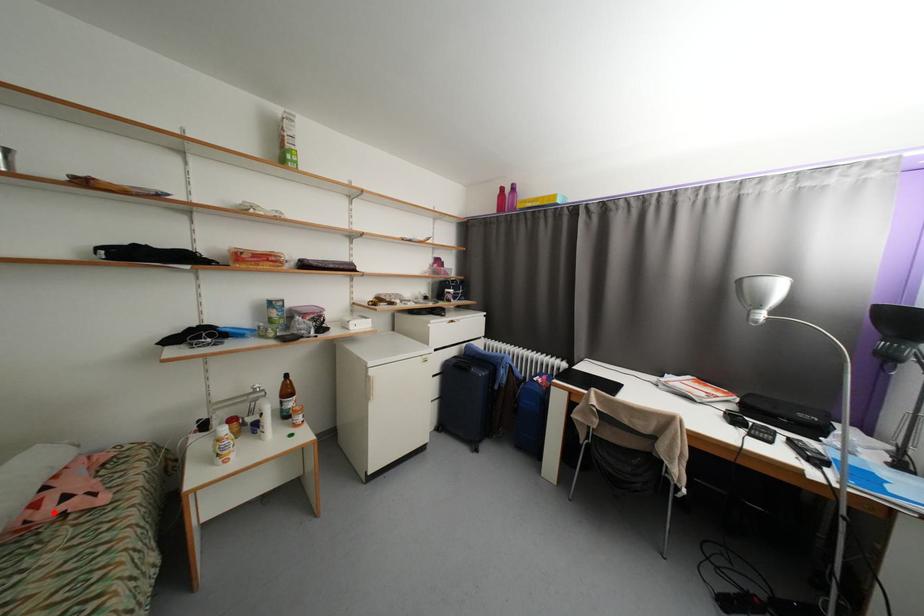
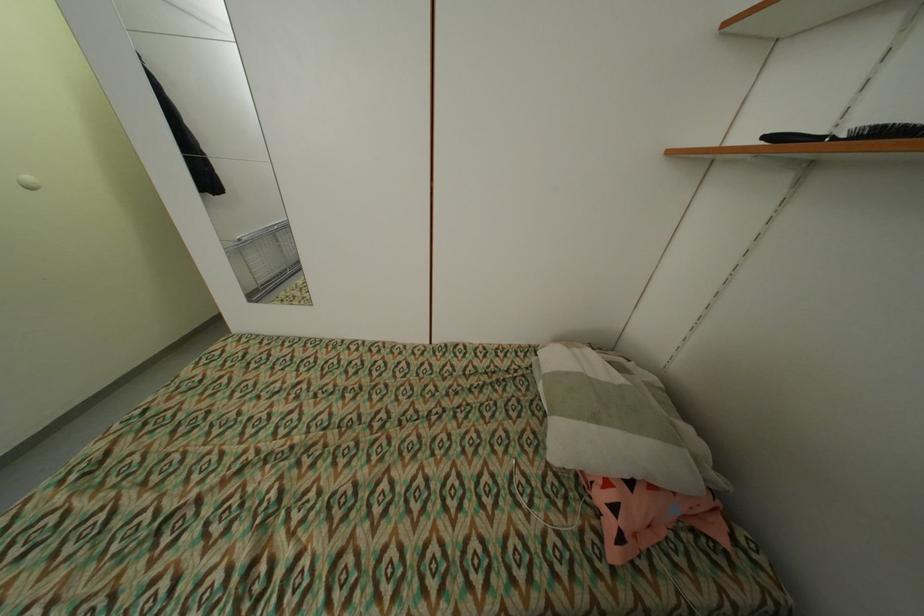
The point at the highlighted location is marked in the first image. Where is the corresponding point in the second image?

(606, 498)